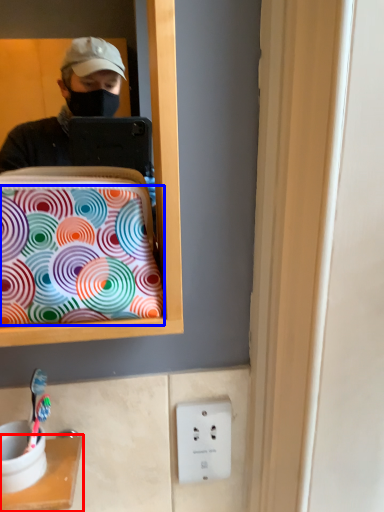
Question: Which of the following is the closest to the observer, furniture (highlighted by a red box) or pattern (highlighted by a blue box)?

Choices:
 (A) furniture
 (B) pattern

Answer: (B)